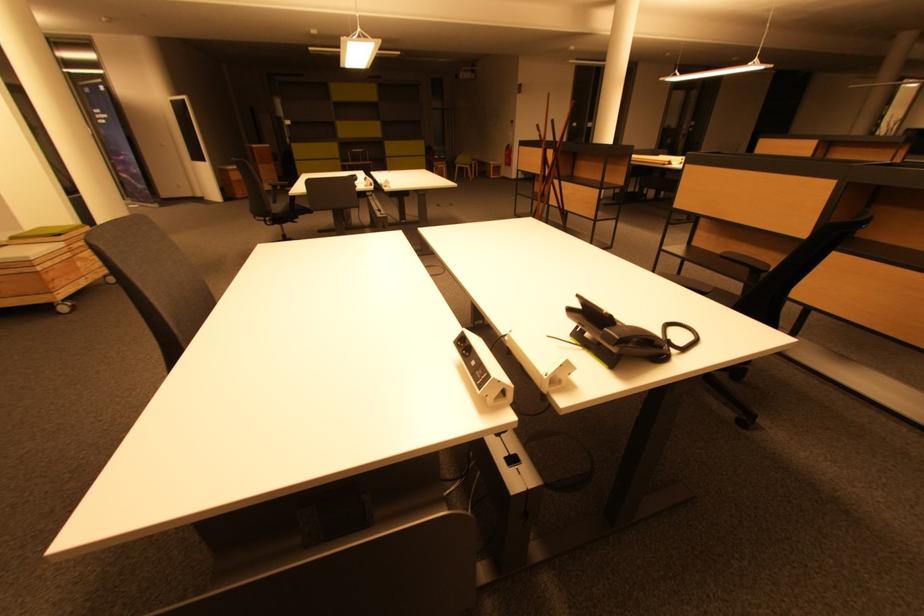
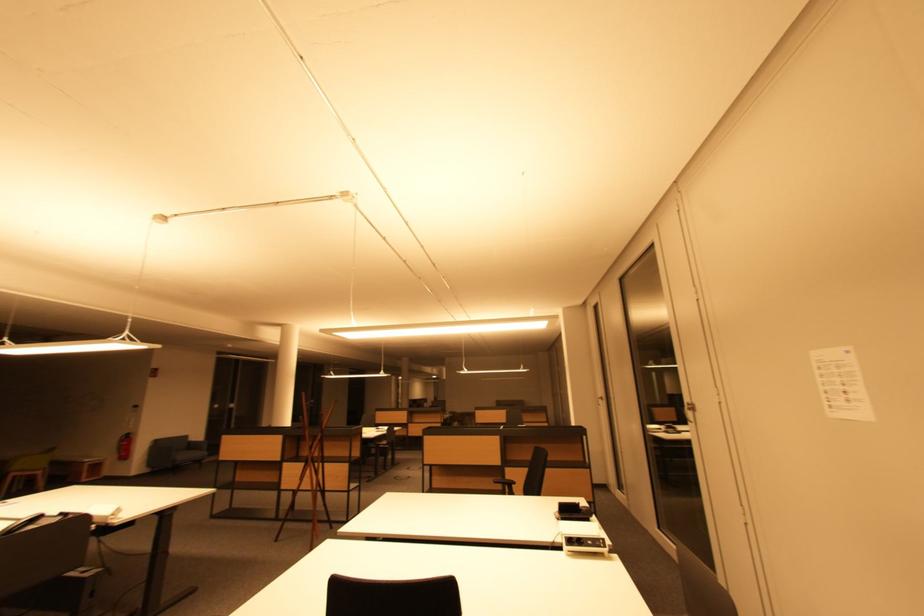
In the second image, find the point that corresponds to (582,310) in the first image.

(563, 512)